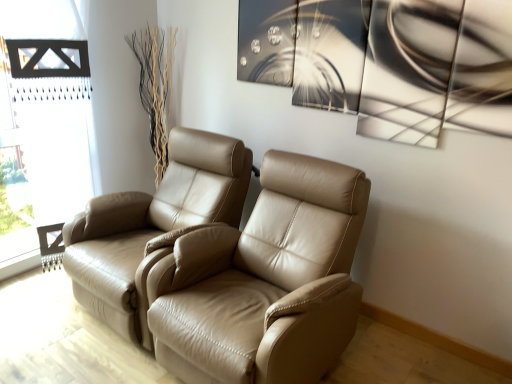
Locate an element on the screen. vacant area that lies between tan leather chair at left, the first chair in the left-to-right sequence, and tan leather recliner at center, acting as the 2th chair starting from the left is located at coordinates (102, 354).